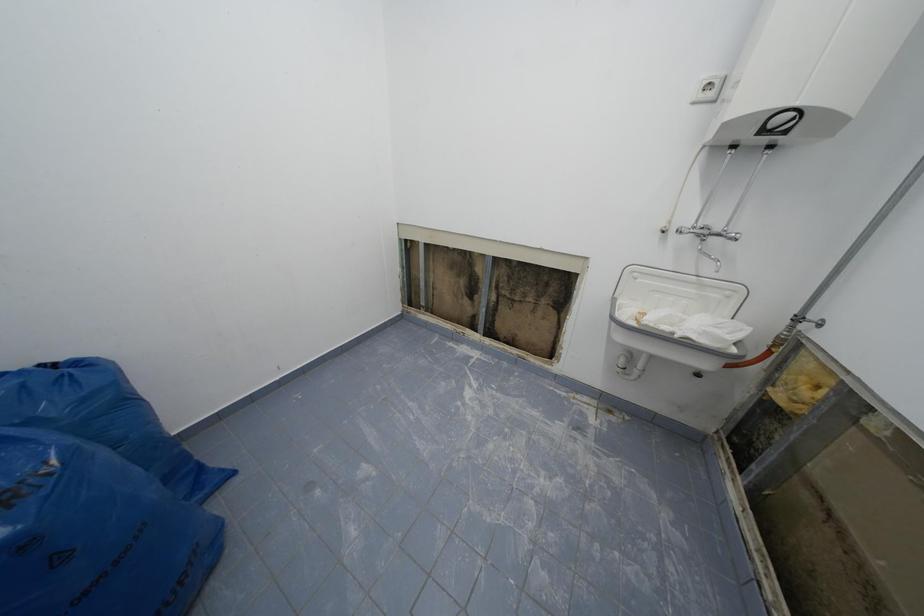
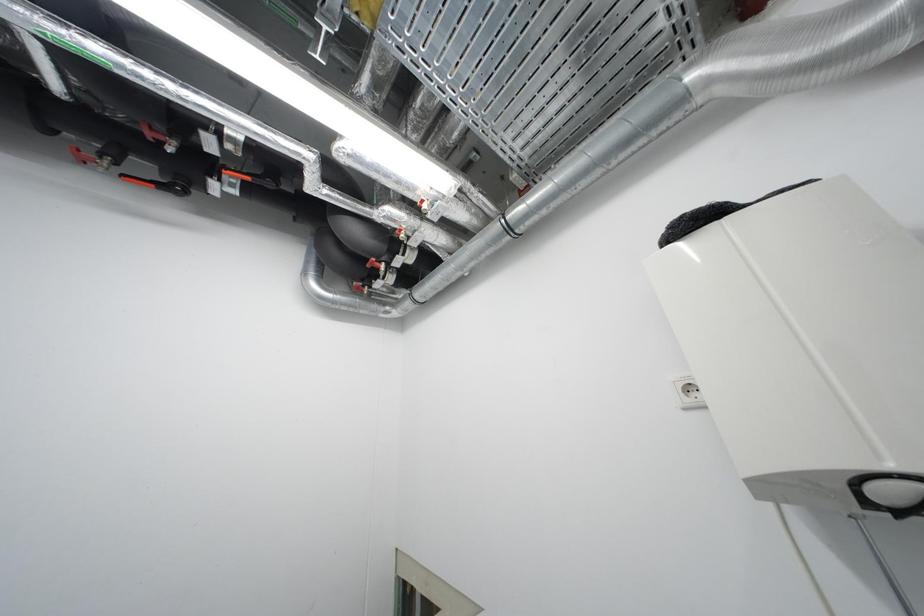
The first image is from the beginning of the video and the second image is from the end. How did the camera likely rotate when shooting the video?

The camera rotated toward left-up.